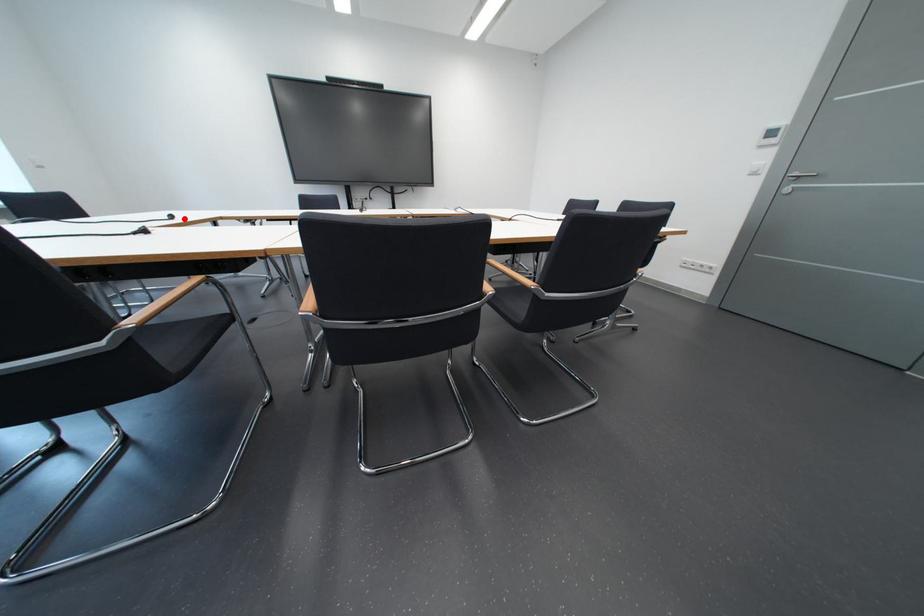
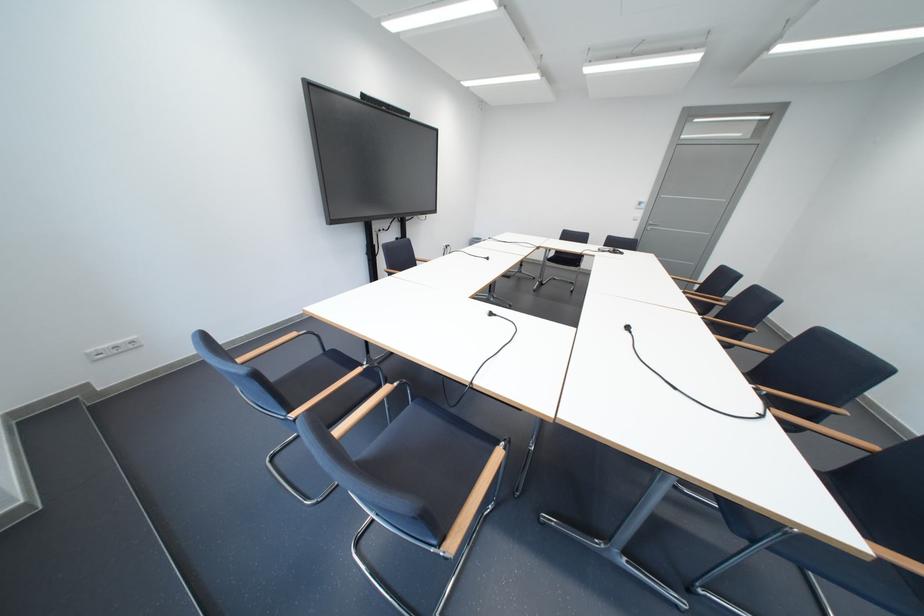
The point at the highlighted location is marked in the first image. Where is the corresponding point in the second image?

(503, 315)